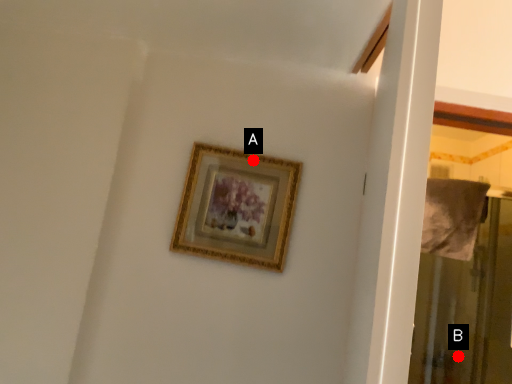
Question: Two points are circled on the image, labeled by A and B beside each circle. Which of the following is the closest to the observer?

Choices:
 (A) A is closer
 (B) B is closer

Answer: (A)